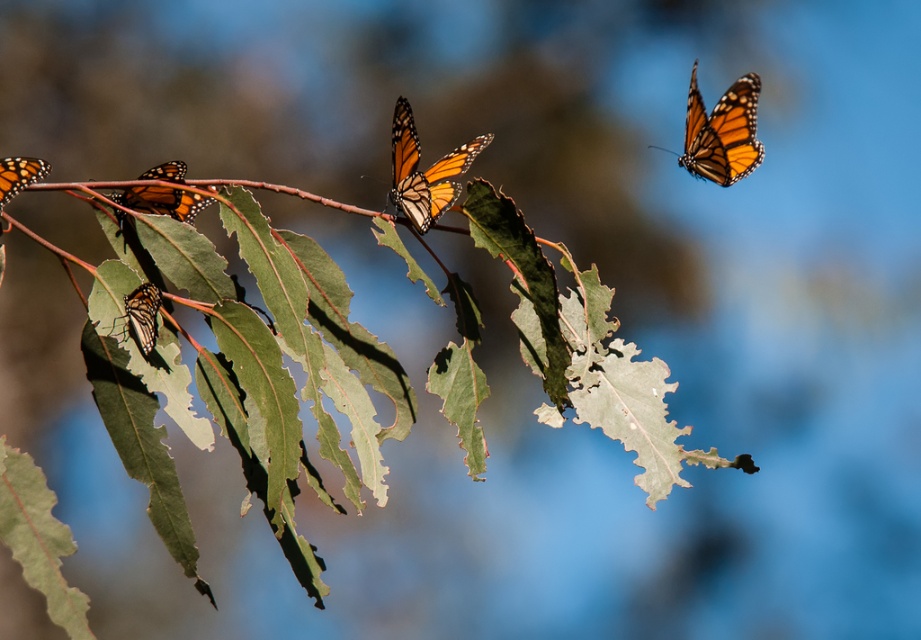
You are an entomologist observing the scene. You notice a butterfly at point (426,172). What color is the butterfly at that point?

The butterfly at point (426,172) is orange matte butterfly at center.